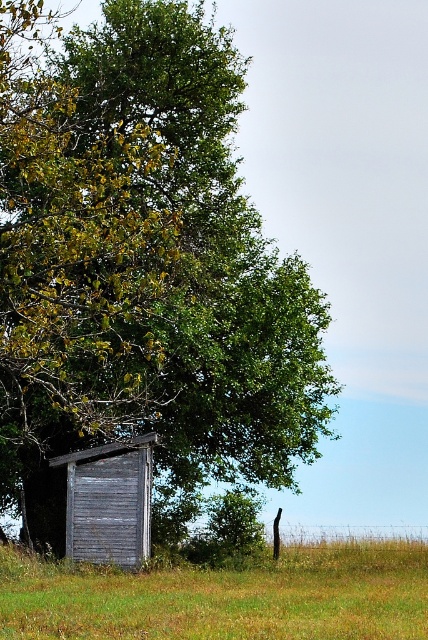
Question: Based on their relative distances, which object is farther from the green grass at lower center?

Choices:
 (A) weathered wood shed at lower left
 (B) green leafy tree at upper left

Answer: (B)

Question: Can you confirm if green leafy tree at upper left is positioned below weathered wood shed at lower left?

Choices:
 (A) no
 (B) yes

Answer: (A)

Question: Can you confirm if green leafy tree at upper left is positioned below weathered wood shed at lower left?

Choices:
 (A) no
 (B) yes

Answer: (A)

Question: Estimate the real-world distances between objects in this image. Which object is closer to the green leafy tree at upper left?

Choices:
 (A) green grass at lower center
 (B) weathered wood shed at lower left

Answer: (B)

Question: Can you confirm if green leafy tree at upper left is bigger than green grass at lower center?

Choices:
 (A) yes
 (B) no

Answer: (A)

Question: Which of these objects is positioned closest to the green leafy tree at upper left?

Choices:
 (A) green grass at lower center
 (B) weathered wood shed at lower left

Answer: (B)